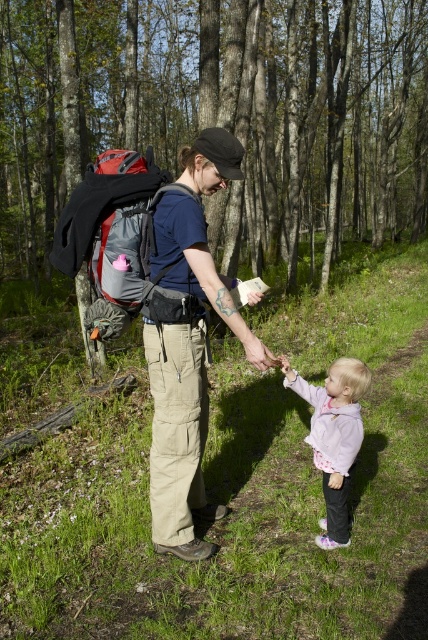
Can you confirm if matte blue shirt at center is positioned to the right of pink fleece jacket at lower right?

No, matte blue shirt at center is not to the right of pink fleece jacket at lower right.

Is point (220, 138) behind point (320, 438)?

No.

The width and height of the screenshot is (428, 640). Identify the location of matte blue shirt at center. click(189, 346).

Is matte gray backpack at center taller than pink fleece jacket at lower right?

Incorrect, matte gray backpack at center's height is not larger of pink fleece jacket at lower right's.

Identify the location of matte gray backpack at center. (115, 236).

Who is shorter, matte blue shirt at center or matte gray backpack at center?

With less height is matte gray backpack at center.

Can you confirm if matte blue shirt at center is positioned to the left of matte gray backpack at center?

In fact, matte blue shirt at center is to the right of matte gray backpack at center.

The height and width of the screenshot is (640, 428). What do you see at coordinates (189, 346) in the screenshot?
I see `matte blue shirt at center` at bounding box center [189, 346].

Locate an element on the screen. matte blue shirt at center is located at coordinates (189, 346).